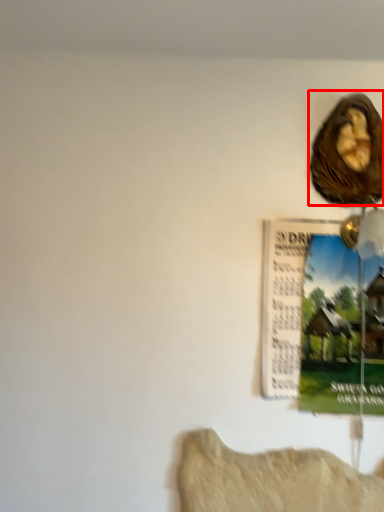
Question: From the image's perspective, considering the relative positions of art (annotated by the red box) and poster page in the image provided, where is art (annotated by the red box) located with respect to the staircase?

Choices:
 (A) above
 (B) below

Answer: (A)